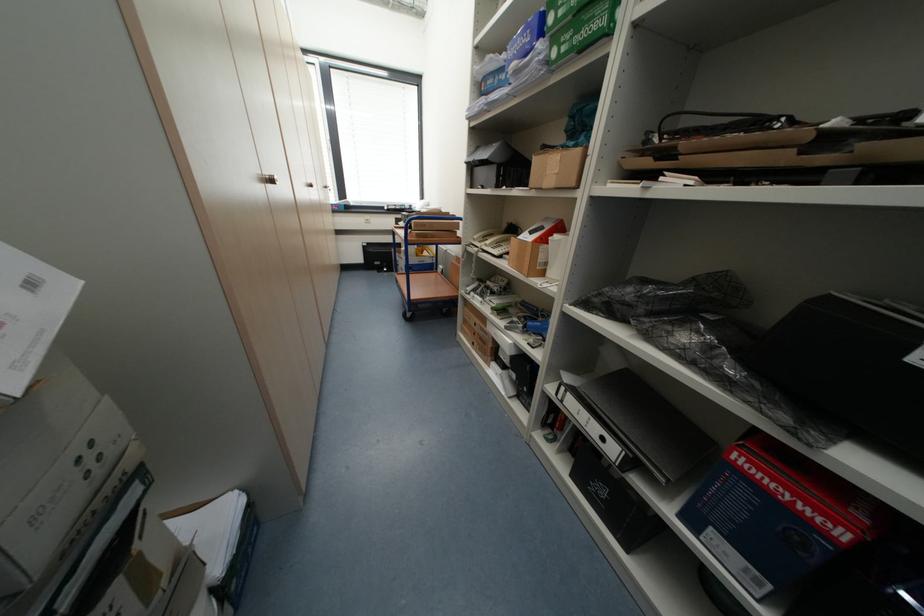
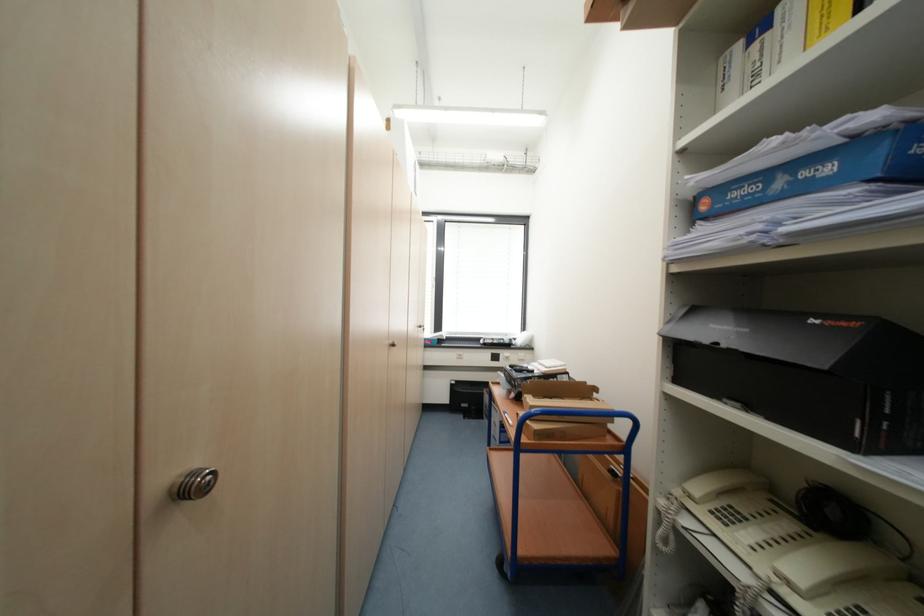
The point at (419, 299) is marked in the first image. Where is the corresponding point in the second image?

(527, 552)